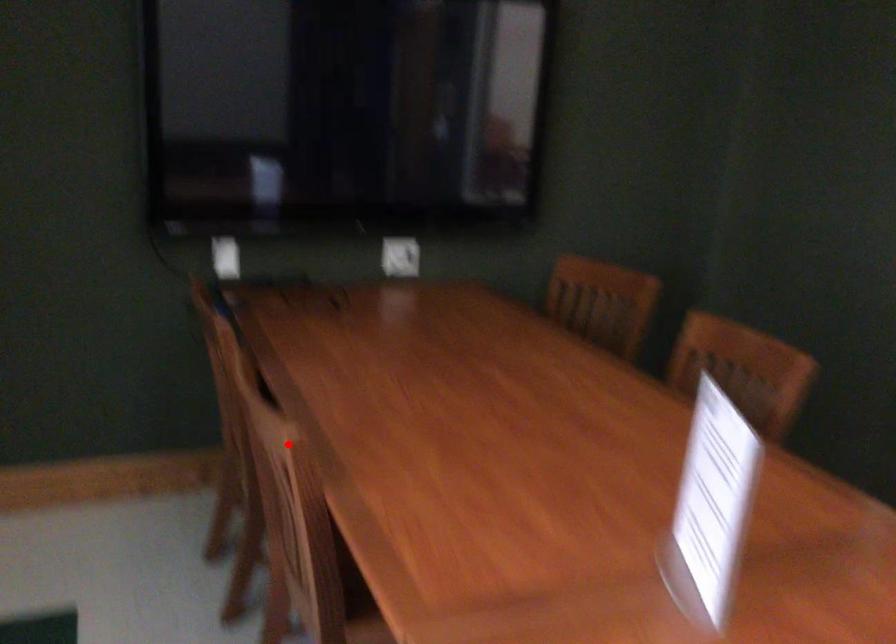
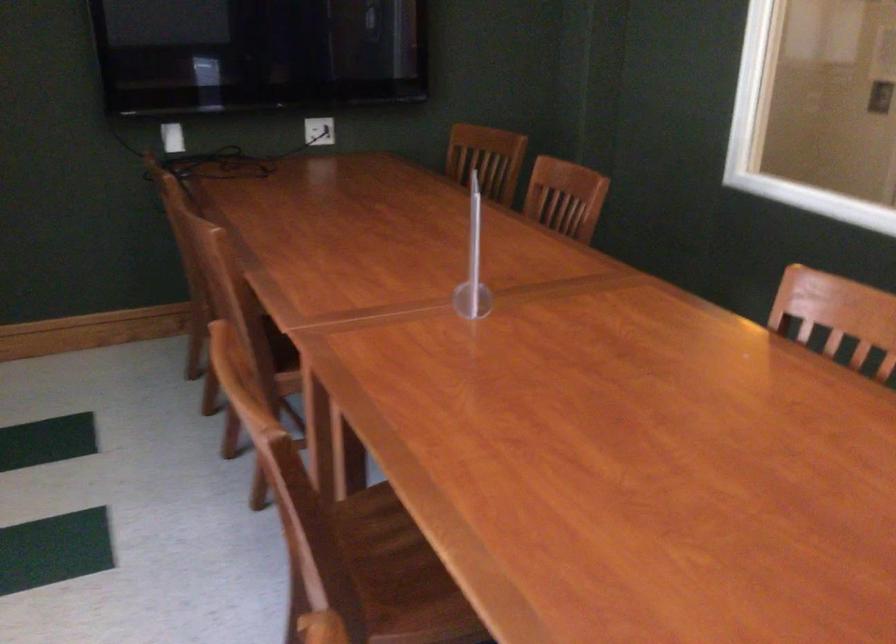
Where in the second image is the point corresponding to the highlighted location from the first image?

(216, 242)